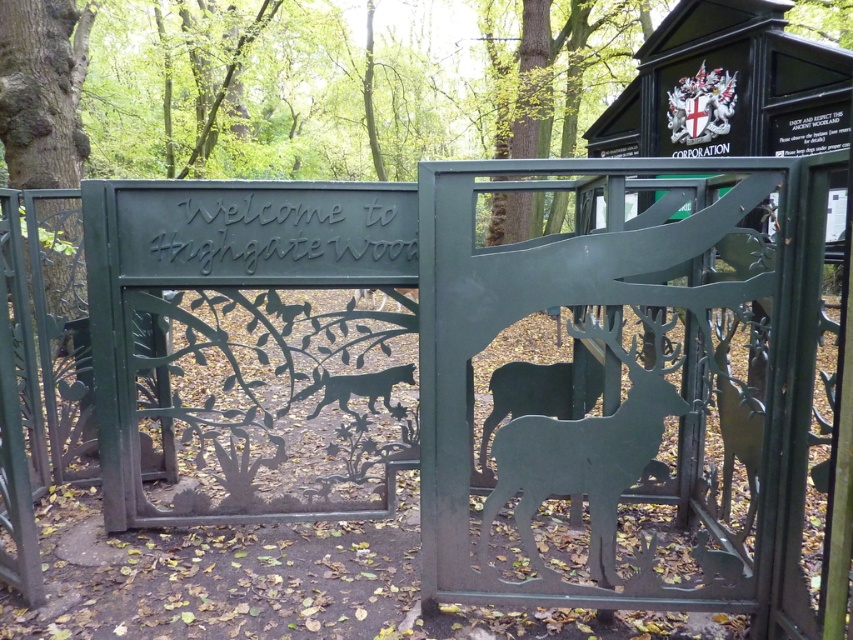
You are a visitor approaching the entrance of Highgate Wood. You see the black matte deer at center and the green metal sign at upper right. Which object is bigger in size?

The black matte deer at center is larger in size compared to the green metal sign at upper right.

You are a visitor approaching the entrance of Highgate Wood. You see a green matte deer at center and a green metal gate at right. Which object is bigger?

The green matte deer at center is larger in size than the green metal gate at right.